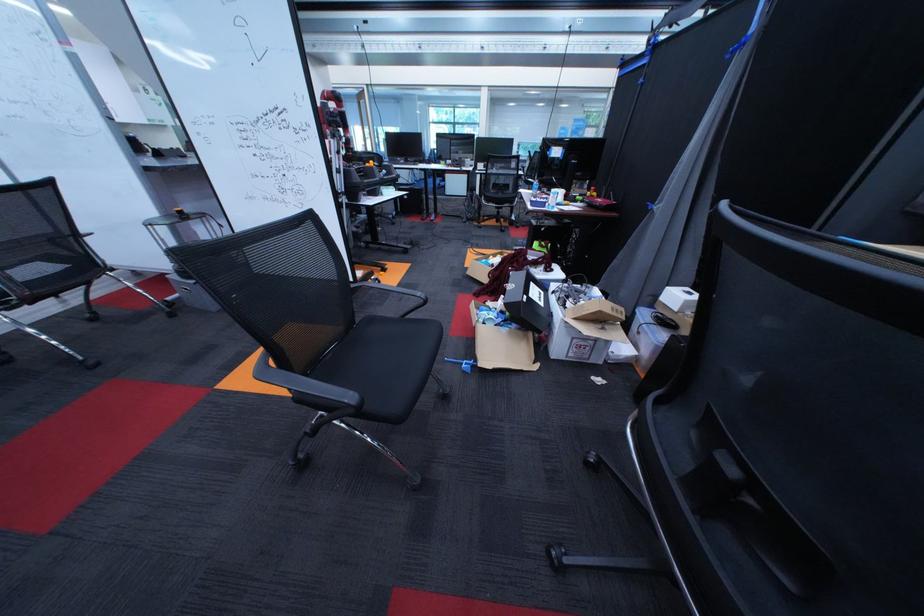
Where would you lift the black product box? Please return your answer as a coordinate pair (x, y).

(527, 301)